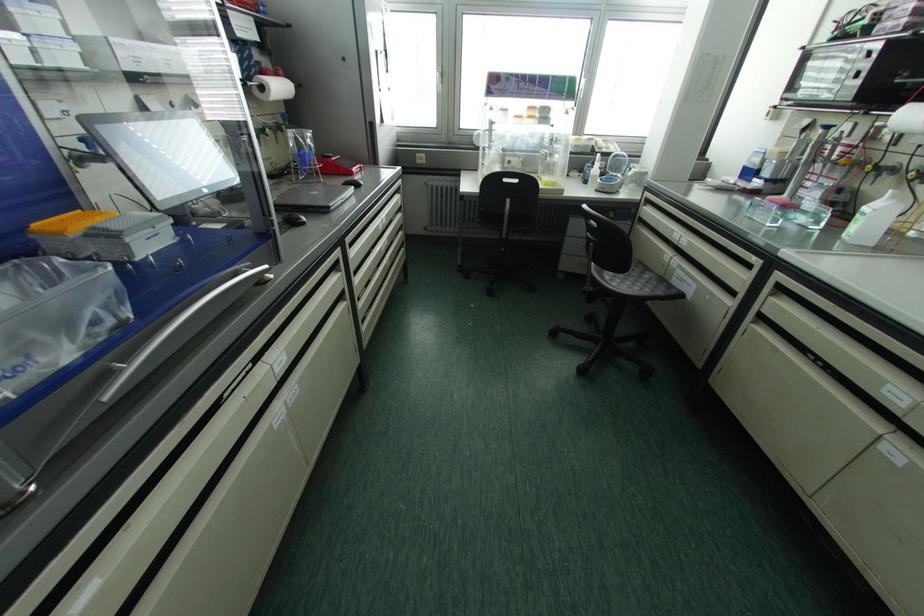
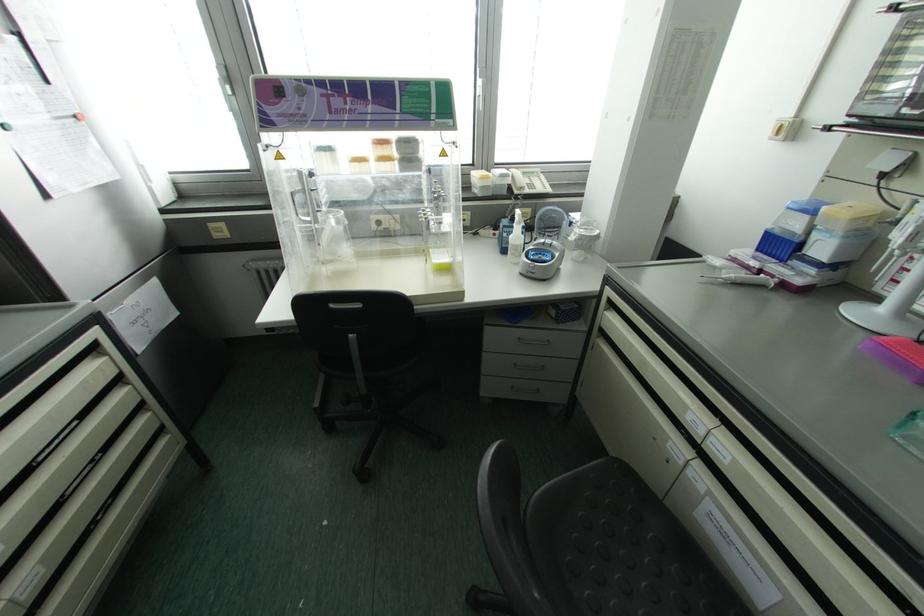
The point at (492, 161) is marked in the first image. Where is the corresponding point in the second image?

(334, 238)